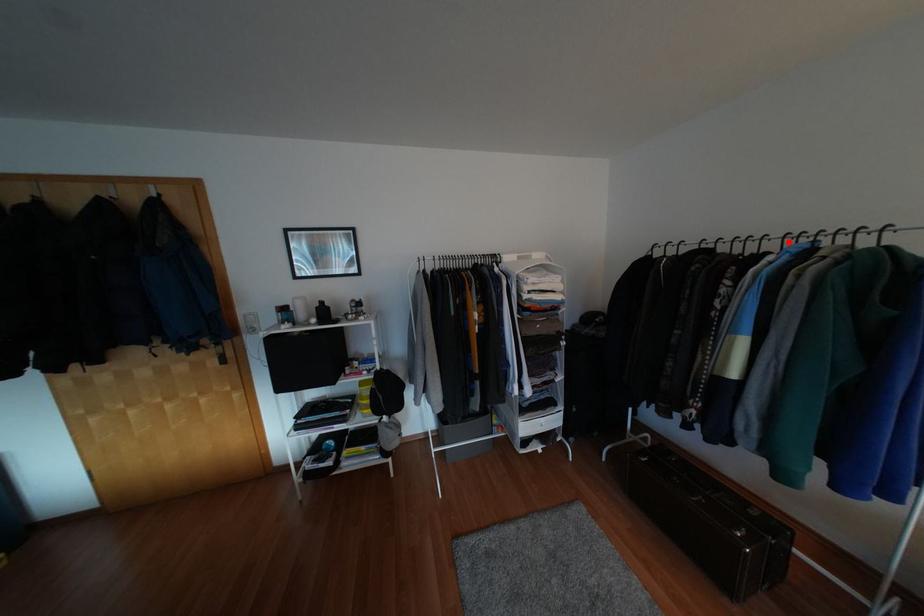
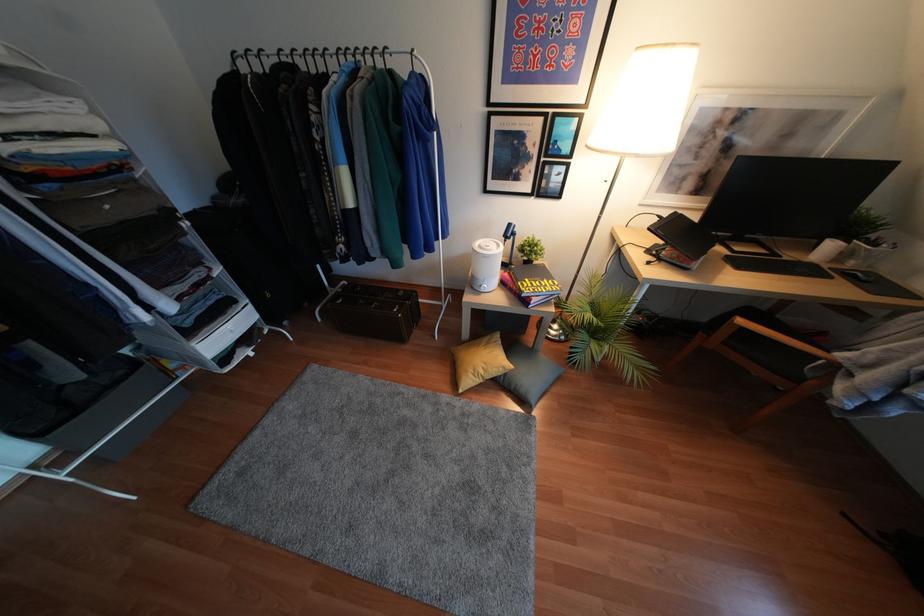
Locate, in the second image, the point that corresponds to the highlighted location in the first image.

(342, 59)